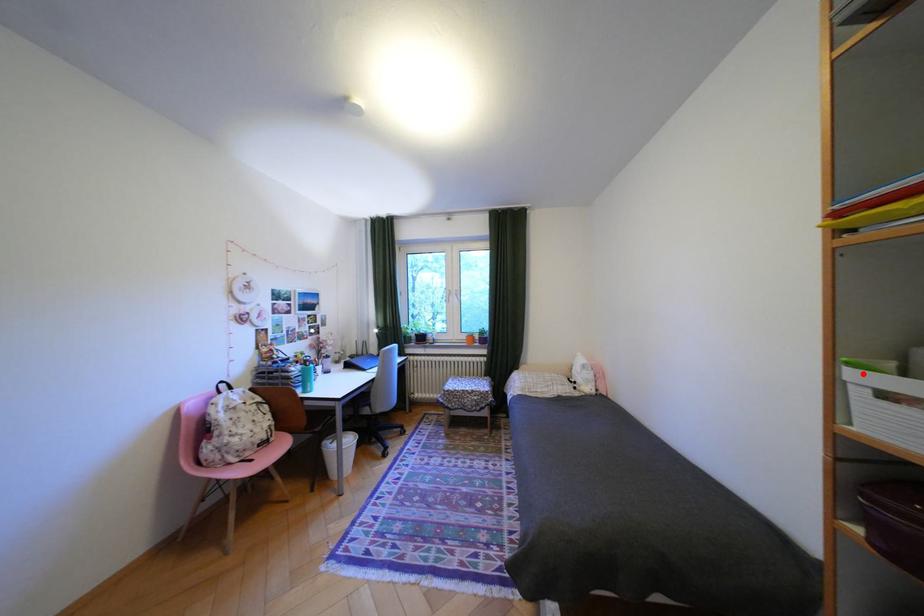
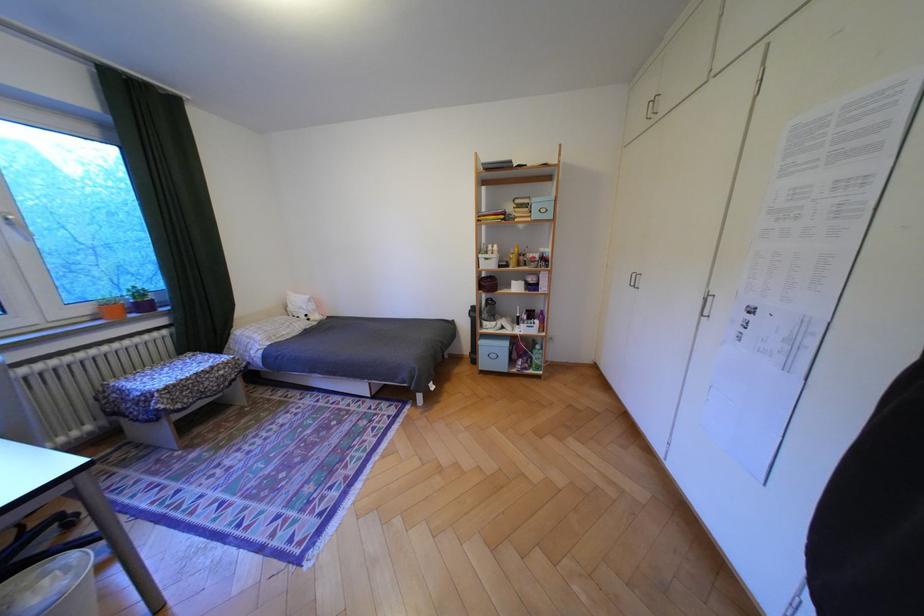
The point at the highlighted location is marked in the first image. Where is the corresponding point in the second image?

(492, 256)